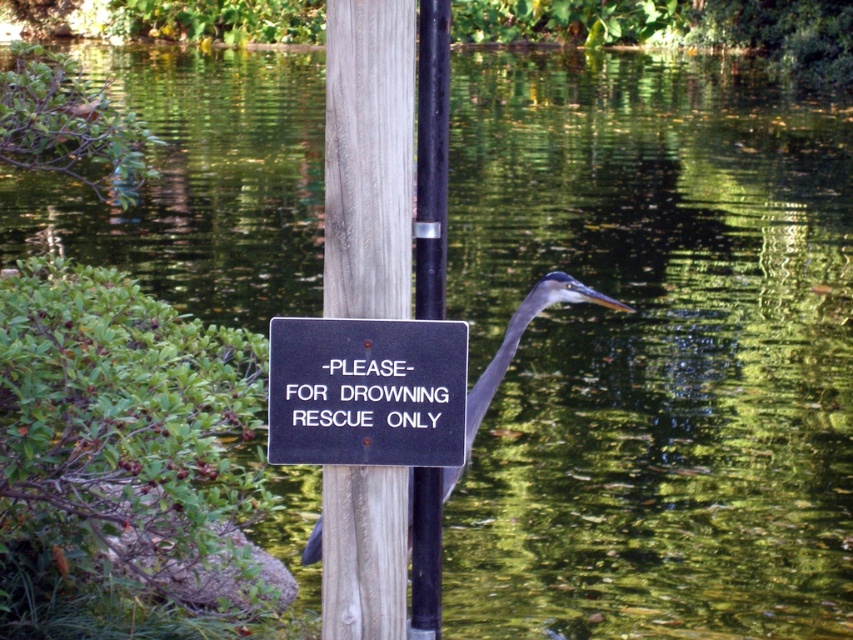
Question: Can you confirm if wooden post at center is positioned to the right of black plastic sign at center?

Choices:
 (A) yes
 (B) no

Answer: (B)

Question: Which point is closer to the camera?

Choices:
 (A) (431, 627)
 (B) (366, 458)
 (C) (329, 180)

Answer: (C)

Question: Is wooden post at center closer to camera compared to black wood pole at center?

Choices:
 (A) yes
 (B) no

Answer: (A)

Question: Is wooden post at center bigger than black wood pole at center?

Choices:
 (A) yes
 (B) no

Answer: (A)

Question: Estimate the real-world distances between objects in this image. Which object is farther from the black plastic sign at center?

Choices:
 (A) gray matte heron at center
 (B) wooden post at center

Answer: (A)

Question: Which is farther from the gray matte heron at center?

Choices:
 (A) wooden post at center
 (B) black wood pole at center

Answer: (A)